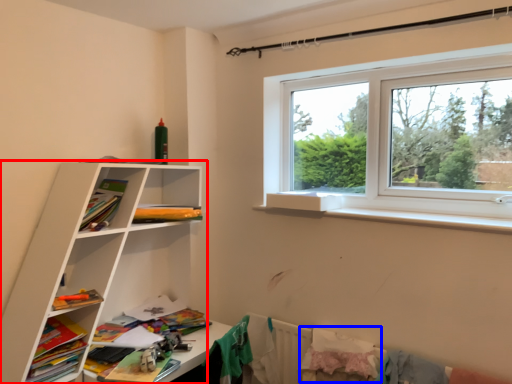
Question: Among these objects, which one is nearest to the camera, shelf (highlighted by a red box) or clothing (highlighted by a blue box)?

Choices:
 (A) shelf
 (B) clothing

Answer: (A)